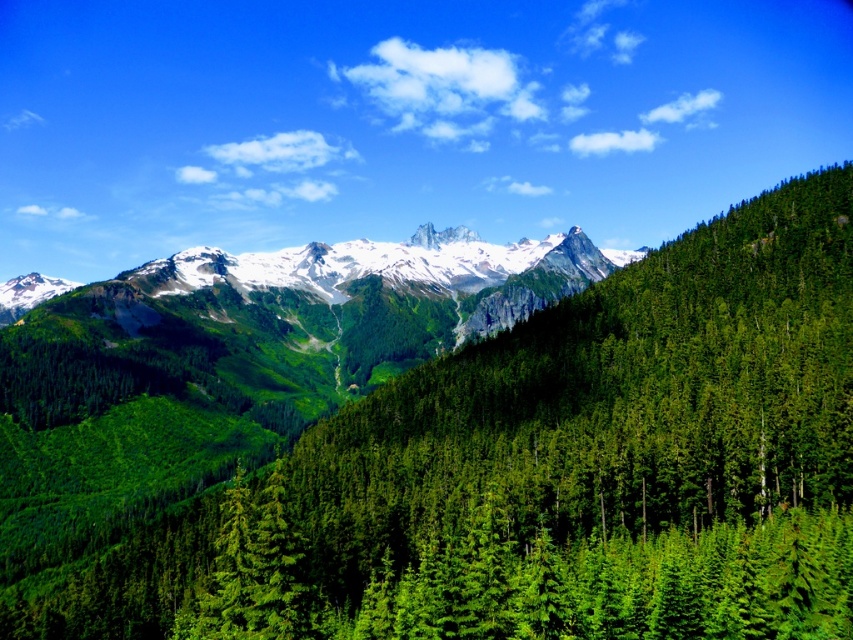
Question: Is green forested mountain at center to the right of white snow-covered mountain range at center from the viewer's perspective?

Choices:
 (A) no
 (B) yes

Answer: (B)

Question: Which point is closer to the camera?

Choices:
 (A) green forested mountain at center
 (B) white snow-covered mountain range at center

Answer: (A)

Question: Does green forested mountain at center appear under white snow-covered mountain range at center?

Choices:
 (A) yes
 (B) no

Answer: (A)

Question: Does green forested mountain at center have a larger size compared to white snow-covered mountain range at center?

Choices:
 (A) yes
 (B) no

Answer: (B)